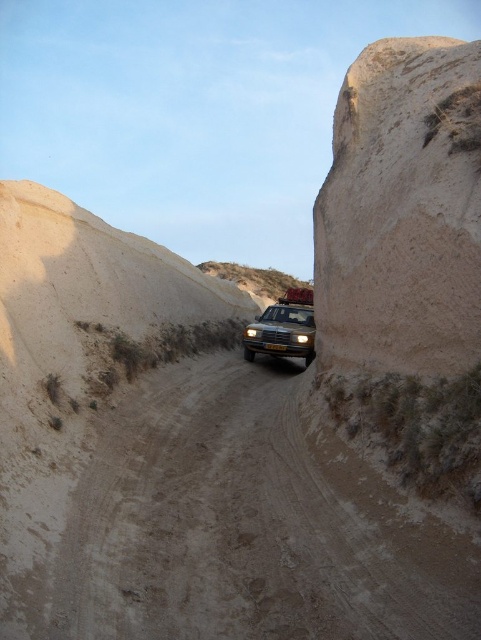
Question: Can you confirm if matte black car at center is bigger than matte black headlight at center?

Choices:
 (A) yes
 (B) no

Answer: (A)

Question: Can you confirm if brown sandy dirt track at center is positioned to the left of matte black car at center?

Choices:
 (A) no
 (B) yes

Answer: (B)

Question: Which object is the closest to the matte black car at center?

Choices:
 (A) brown sandy dirt track at center
 (B) matte black headlight at center
 (C) matte yellow headlight at center

Answer: (B)

Question: Which of the following is the closest to the observer?

Choices:
 (A) (296, 336)
 (B) (311, 333)

Answer: (A)

Question: Which object is positioned farthest from the matte yellow headlight at center?

Choices:
 (A) brown sandy dirt track at center
 (B) matte black car at center

Answer: (A)

Question: Can you confirm if brown sandy dirt track at center is positioned below matte black car at center?

Choices:
 (A) yes
 (B) no

Answer: (A)